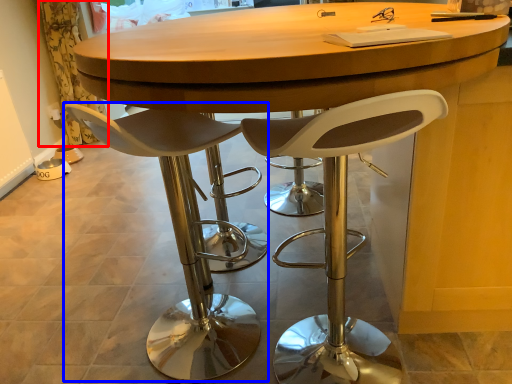
Question: Which point is further to the camera, curtain (highlighted by a red box) or chair (highlighted by a blue box)?

Choices:
 (A) curtain
 (B) chair

Answer: (A)